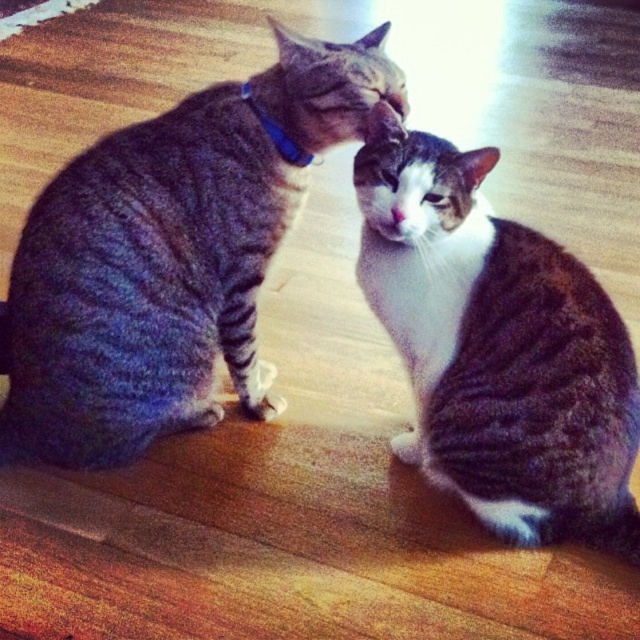
Question: Is the position of gray tabby cat at center less distant than that of white fur at center?

Choices:
 (A) yes
 (B) no

Answer: (A)

Question: Can you confirm if gray striped cat at left is smaller than blue fabric neckband at upper center?

Choices:
 (A) no
 (B) yes

Answer: (A)

Question: Does gray striped cat at left have a greater width compared to white fur at center?

Choices:
 (A) no
 (B) yes

Answer: (B)

Question: Among these objects, which one is nearest to the camera?

Choices:
 (A) gray striped cat at left
 (B) white fur at center

Answer: (B)

Question: Which point is farther from the camera taking this photo?

Choices:
 (A) (280, 150)
 (B) (304, 36)
 (C) (394, 220)

Answer: (A)

Question: Which of the following is the closest to the observer?

Choices:
 (A) [392, 214]
 (B) [154, 401]
 (C) [304, 163]
 (D) [550, 490]

Answer: (A)